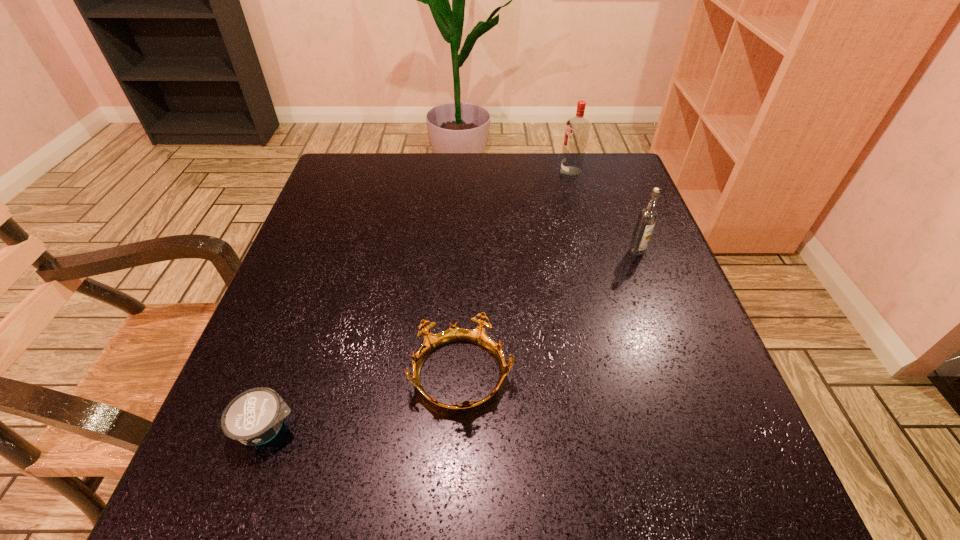
Locate an element on the screen. This screenshot has height=540, width=960. the taller vodka is located at coordinates (577, 130).

The height and width of the screenshot is (540, 960). In order to click on the tallest object in this screenshot , I will do `click(577, 130)`.

You are a GUI agent. You are given a task and a screenshot of the screen. Output one action in this format:
    pyautogui.click(x=<x>, y=<y>)
    Task: Click on the second tallest object
    The height and width of the screenshot is (540, 960).
    Given the screenshot: What is the action you would take?
    pyautogui.click(x=647, y=217)

I want to click on the shorter vodka, so click(x=647, y=217).

Find the location of a particular element. The image size is (960, 540). crown is located at coordinates (478, 336).

Where is `the third tallest object`? the third tallest object is located at coordinates (478, 336).

Locate an element on the screen. yogurt is located at coordinates (254, 417).

Find the location of a particular element. The height and width of the screenshot is (540, 960). the leftmost object is located at coordinates (254, 417).

Locate an element on the screen. free space located on the front label of the left vodka is located at coordinates (511, 172).

Where is `free space located 0.310m on the front label of the left vodka`? free space located 0.310m on the front label of the left vodka is located at coordinates (444, 172).